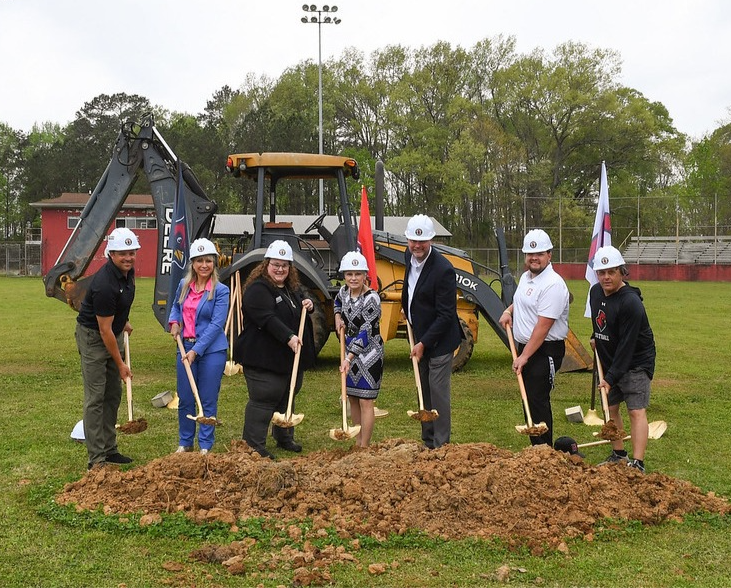
I want to click on light, so click(319, 3).